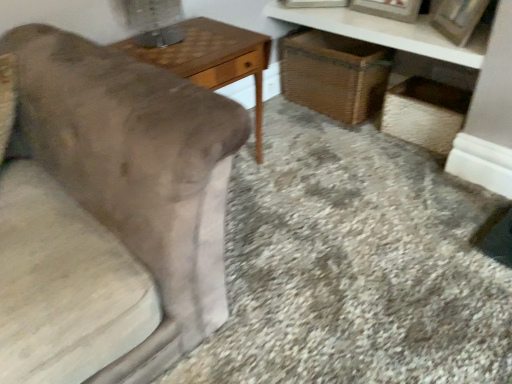
Identify the location of vacant area to the right of metallic silver table lamp at upper left. This screenshot has width=512, height=384. (210, 42).